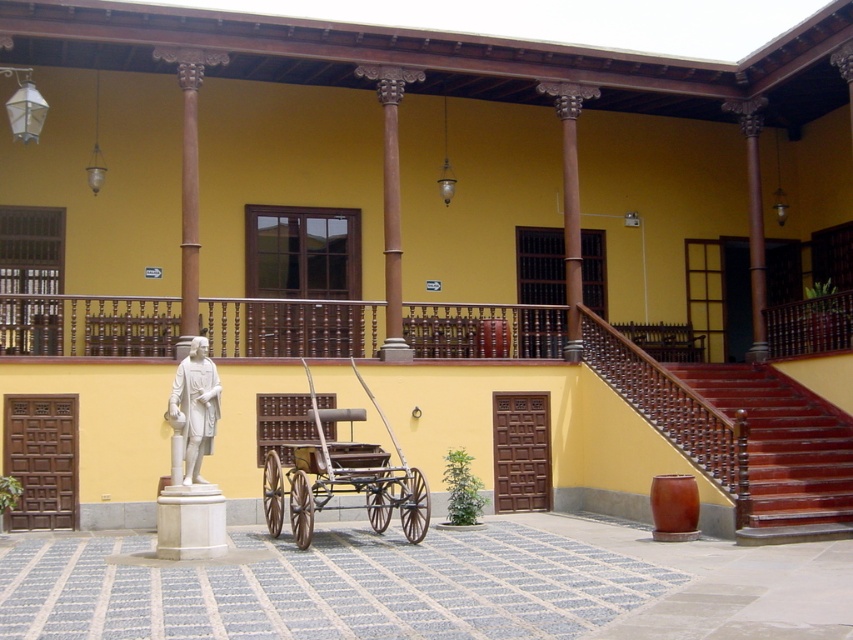
Question: Is shiny red wood stairs at right closer to camera compared to white marble statue at center?

Choices:
 (A) no
 (B) yes

Answer: (A)

Question: Which object is closer to the camera taking this photo?

Choices:
 (A) rustic wood cart at center
 (B) shiny red wood stairs at right

Answer: (A)

Question: Can you confirm if shiny red wood stairs at right is positioned above white marble statue at center?

Choices:
 (A) yes
 (B) no

Answer: (B)

Question: Which object is the closest to the white marble statue at center?

Choices:
 (A) rustic wood cart at center
 (B) shiny red wood stairs at right

Answer: (A)

Question: Where is rustic wood cart at center located in relation to white marble statue at center in the image?

Choices:
 (A) left
 (B) right

Answer: (B)

Question: Which of the following is the closest to the observer?

Choices:
 (A) white marble statue at center
 (B) shiny red wood stairs at right

Answer: (A)